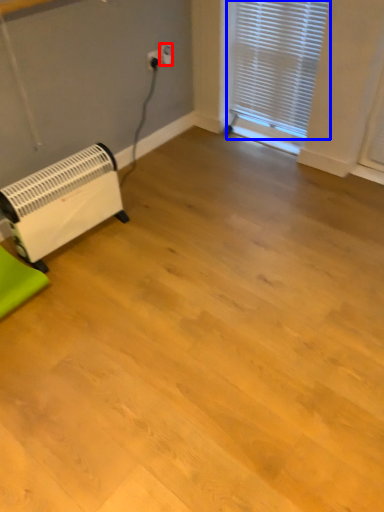
Question: Which point is further to the camera, electric outlet (highlighted by a red box) or window blind (highlighted by a blue box)?

Choices:
 (A) electric outlet
 (B) window blind

Answer: (A)